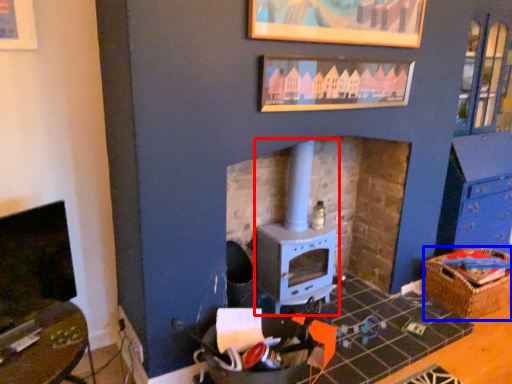
Question: Which of the following is the farthest to the observer, wood burning stove (highlighted by a red box) or crate (highlighted by a blue box)?

Choices:
 (A) wood burning stove
 (B) crate

Answer: (B)